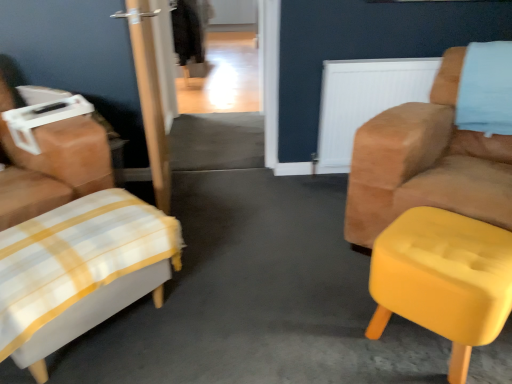
Question: From the image's perspective, would you say white fabric ottoman at left, which ranks as the second chair in right-to-left order, is positioned over white plaid ottoman at lower left, the second furniture from the right?

Choices:
 (A) no
 (B) yes

Answer: (B)

Question: Does white fabric ottoman at left, which ranks as the second chair in right-to-left order, come in front of white plaid ottoman at lower left, which is counted as the 1th furniture, starting from the left?

Choices:
 (A) no
 (B) yes

Answer: (A)

Question: Is white fabric ottoman at left, placed as the first chair when sorted from left to right, far away from white plaid ottoman at lower left, the second furniture from the right?

Choices:
 (A) no
 (B) yes

Answer: (A)

Question: From a real-world perspective, is white fabric ottoman at left, which ranks as the second chair in right-to-left order, beneath white plaid ottoman at lower left, which is counted as the 1th furniture, starting from the left?

Choices:
 (A) no
 (B) yes

Answer: (A)

Question: Is white fabric ottoman at left, which ranks as the second chair in right-to-left order, with white plaid ottoman at lower left, the second furniture from the right?

Choices:
 (A) no
 (B) yes

Answer: (A)

Question: Considering their positions, is white plaid ottoman at lower left, which is counted as the 1th furniture, starting from the left, located in front of or behind white textured radiator at upper right?

Choices:
 (A) behind
 (B) front

Answer: (B)

Question: Considering the positions of white plaid ottoman at lower left, the second furniture from the right, and white textured radiator at upper right in the image, is white plaid ottoman at lower left, the second furniture from the right, wider or thinner than white textured radiator at upper right?

Choices:
 (A) wide
 (B) thin

Answer: (A)

Question: From their relative heights in the image, would you say white plaid ottoman at lower left, which is counted as the 1th furniture, starting from the left, is taller or shorter than white textured radiator at upper right?

Choices:
 (A) tall
 (B) short

Answer: (B)

Question: From the image's perspective, relative to white textured radiator at upper right, is white plaid ottoman at lower left, which is counted as the 1th furniture, starting from the left, above or below?

Choices:
 (A) below
 (B) above

Answer: (A)

Question: Is suede tan armchair at right, which ranks as the second chair in left-to-right order, situated inside yellow fabric ottoman at right, arranged as the second furniture when viewed from the left, or outside?

Choices:
 (A) inside
 (B) outside

Answer: (B)

Question: From a real-world perspective, relative to yellow fabric ottoman at right, arranged as the second furniture when viewed from the left, is suede tan armchair at right, the 1th chair when ordered from right to left, vertically above or below?

Choices:
 (A) above
 (B) below

Answer: (A)

Question: Considering the positions of suede tan armchair at right, which ranks as the second chair in left-to-right order, and yellow fabric ottoman at right, arranged as the second furniture when viewed from the left, in the image, is suede tan armchair at right, which ranks as the second chair in left-to-right order, bigger or smaller than yellow fabric ottoman at right, arranged as the second furniture when viewed from the left,?

Choices:
 (A) big
 (B) small

Answer: (A)

Question: Is suede tan armchair at right, which ranks as the second chair in left-to-right order, in front of or behind yellow fabric ottoman at right, which appears as the first furniture when viewed from the right, in the image?

Choices:
 (A) front
 (B) behind

Answer: (B)

Question: Considering the positions of white plaid ottoman at lower left, the second furniture from the right, and white fabric ottoman at left, which ranks as the second chair in right-to-left order, in the image, is white plaid ottoman at lower left, the second furniture from the right, wider or thinner than white fabric ottoman at left, which ranks as the second chair in right-to-left order,?

Choices:
 (A) wide
 (B) thin

Answer: (B)

Question: From a real-world perspective, is white plaid ottoman at lower left, the second furniture from the right, above or below white fabric ottoman at left, placed as the first chair when sorted from left to right?

Choices:
 (A) below
 (B) above

Answer: (A)